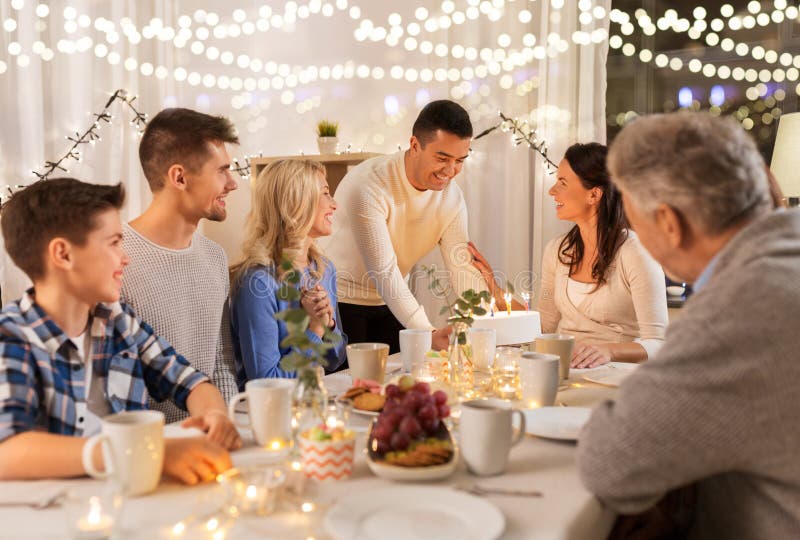
Find the location of a particular element. The image size is (800, 540). fold in the curtains is located at coordinates (46, 90), (13, 106), (96, 89), (142, 94), (540, 106), (577, 89), (605, 116), (524, 188).